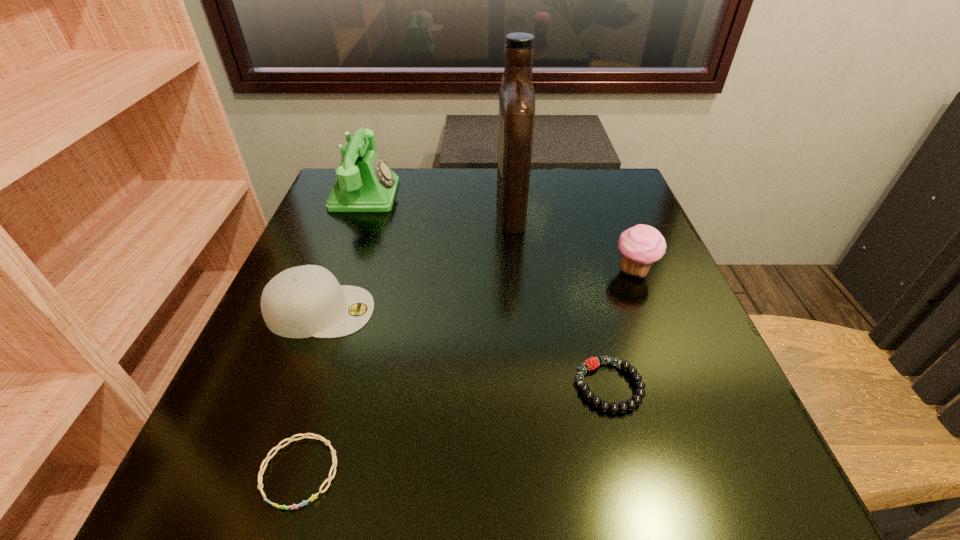
Identify the location of the fourth object from left to right. (516, 97).

Locate an element on the screen. the tallest object is located at coordinates 516,97.

Where is `telephone`? telephone is located at coordinates (364, 183).

Locate an element on the screen. cupcake is located at coordinates (641, 245).

Where is `the third tallest object`? Image resolution: width=960 pixels, height=540 pixels. the third tallest object is located at coordinates (641, 245).

Where is `the third nearest object`? The height and width of the screenshot is (540, 960). the third nearest object is located at coordinates (303, 301).

Locate an element on the screen. The image size is (960, 540). cap is located at coordinates (303, 301).

You are a GUI agent. You are given a task and a screenshot of the screen. Output one action in this format:
    pyautogui.click(x=<x>, y=<y>)
    Task: Click on the farther bracelet
    
    Given the screenshot: What is the action you would take?
    pyautogui.click(x=592, y=363)

The height and width of the screenshot is (540, 960). Find the location of `the right bracelet`. the right bracelet is located at coordinates (592, 363).

Locate an element on the screen. the left bracelet is located at coordinates (260, 475).